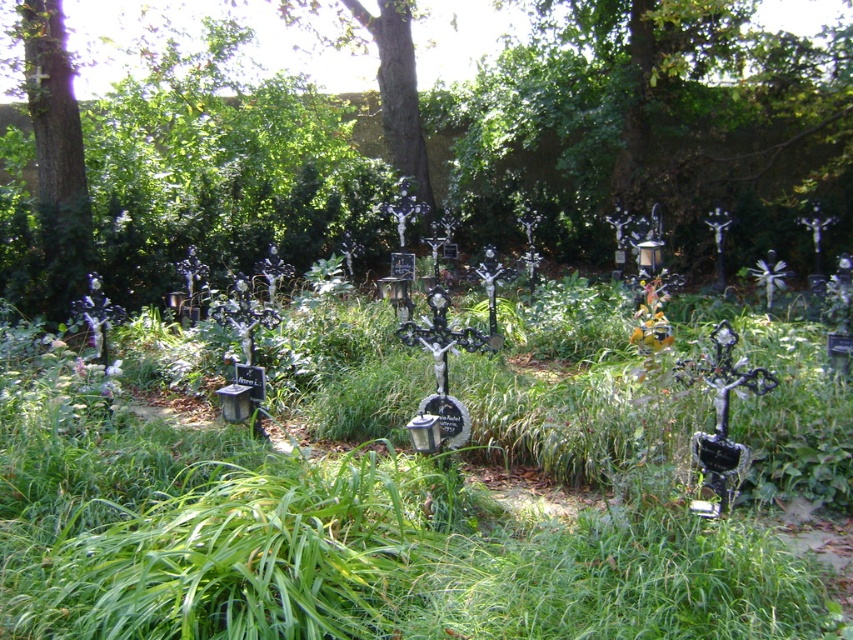
Question: Is green leafy tree at center below smooth bark tree at left?

Choices:
 (A) yes
 (B) no

Answer: (B)

Question: Is green leafy tree at center thinner than smooth bark tree at left?

Choices:
 (A) no
 (B) yes

Answer: (A)

Question: Which of the following is the farthest from the observer?

Choices:
 (A) (120, 218)
 (B) (80, 177)

Answer: (A)

Question: Which of the following is the farthest from the observer?

Choices:
 (A) smooth bark tree at left
 (B) green leafy tree at center

Answer: (A)

Question: Is green leafy tree at center thinner than smooth bark tree at left?

Choices:
 (A) yes
 (B) no

Answer: (B)

Question: Which of the following is the closest to the observer?

Choices:
 (A) (167, 148)
 (B) (38, 67)

Answer: (B)